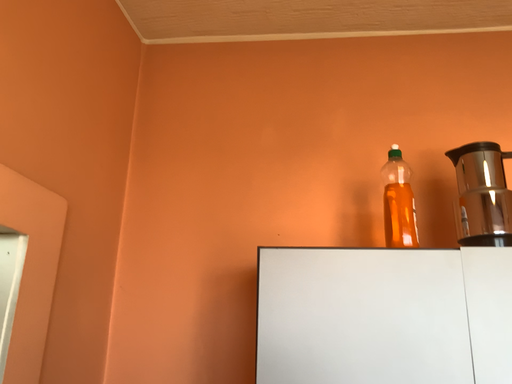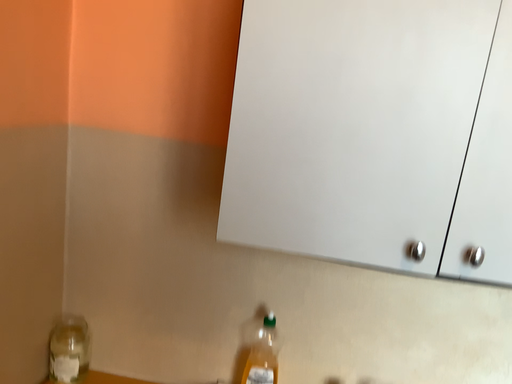
Question: Which way did the camera rotate in the video?

Choices:
 (A) rotated upward
 (B) rotated downward

Answer: (B)